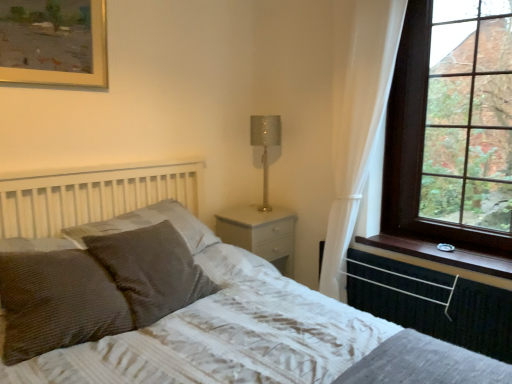
Question: Does brown wooden window at upper right come in front of textured gray bed at center?

Choices:
 (A) yes
 (B) no

Answer: (B)

Question: From a real-world perspective, is brown wooden window at upper right on textured gray bed at center?

Choices:
 (A) yes
 (B) no

Answer: (A)

Question: Considering the relative sizes of brown wooden window at upper right and textured gray bed at center in the image provided, is brown wooden window at upper right shorter than textured gray bed at center?

Choices:
 (A) yes
 (B) no

Answer: (B)

Question: Is brown wooden window at upper right behind textured gray bed at center?

Choices:
 (A) no
 (B) yes

Answer: (B)

Question: Is brown wooden window at upper right turned away from textured gray bed at center?

Choices:
 (A) no
 (B) yes

Answer: (A)

Question: Considering their positions, is brown wood window sill at right located in front of or behind textured brown pillow at center-left, the 3th pillow when ordered from front to back?

Choices:
 (A) front
 (B) behind

Answer: (B)

Question: Does point (480, 266) appear closer or farther from the camera than point (206, 236)?

Choices:
 (A) closer
 (B) farther

Answer: (A)

Question: Considering the positions of brown wood window sill at right and textured brown pillow at center-left, which ranks as the first pillow in back-to-front order, in the image, is brown wood window sill at right wider or thinner than textured brown pillow at center-left, which ranks as the first pillow in back-to-front order,?

Choices:
 (A) wide
 (B) thin

Answer: (B)

Question: Do you think brown wood window sill at right is within textured brown pillow at center-left, the 3th pillow when ordered from front to back, or outside of it?

Choices:
 (A) inside
 (B) outside

Answer: (B)

Question: Considering the positions of brown textured pillow at lower left, the third pillow when ordered from back to front, and gold-framed painting at upper left in the image, is brown textured pillow at lower left, the third pillow when ordered from back to front, wider or thinner than gold-framed painting at upper left?

Choices:
 (A) thin
 (B) wide

Answer: (B)

Question: Considering the positions of point (7, 271) and point (9, 21), is point (7, 271) closer or farther from the camera than point (9, 21)?

Choices:
 (A) farther
 (B) closer

Answer: (B)

Question: From their relative heights in the image, would you say brown textured pillow at lower left, which ranks as the 1th pillow in front-to-back order, is taller or shorter than gold-framed painting at upper left?

Choices:
 (A) tall
 (B) short

Answer: (B)

Question: From the image's perspective, is brown textured pillow at lower left, the third pillow when ordered from back to front, above or below gold-framed painting at upper left?

Choices:
 (A) below
 (B) above

Answer: (A)

Question: In the image, is textured gray bed at center positioned in front of or behind brown wood window sill at right?

Choices:
 (A) behind
 (B) front

Answer: (B)

Question: From the image's perspective, relative to brown wood window sill at right, is textured gray bed at center above or below?

Choices:
 (A) below
 (B) above

Answer: (A)